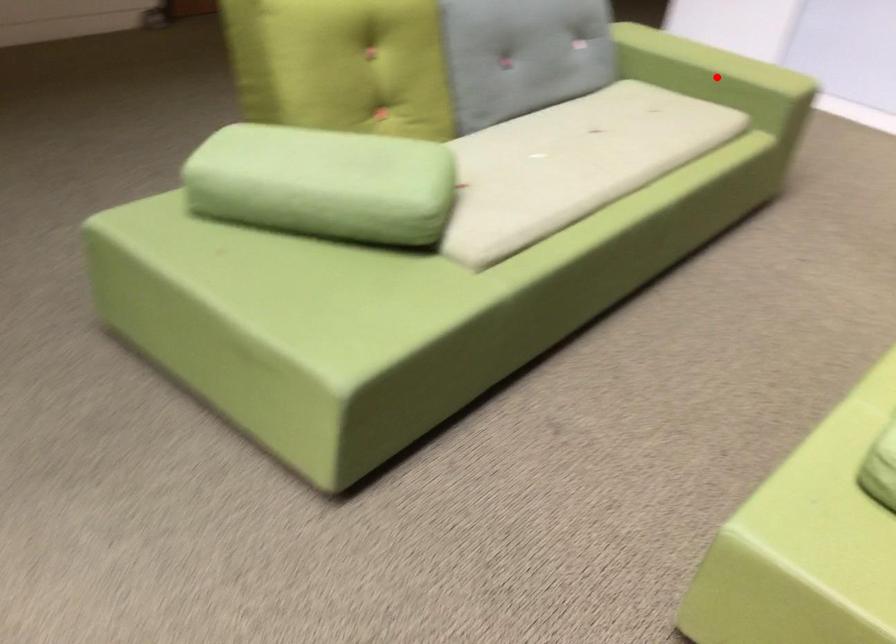
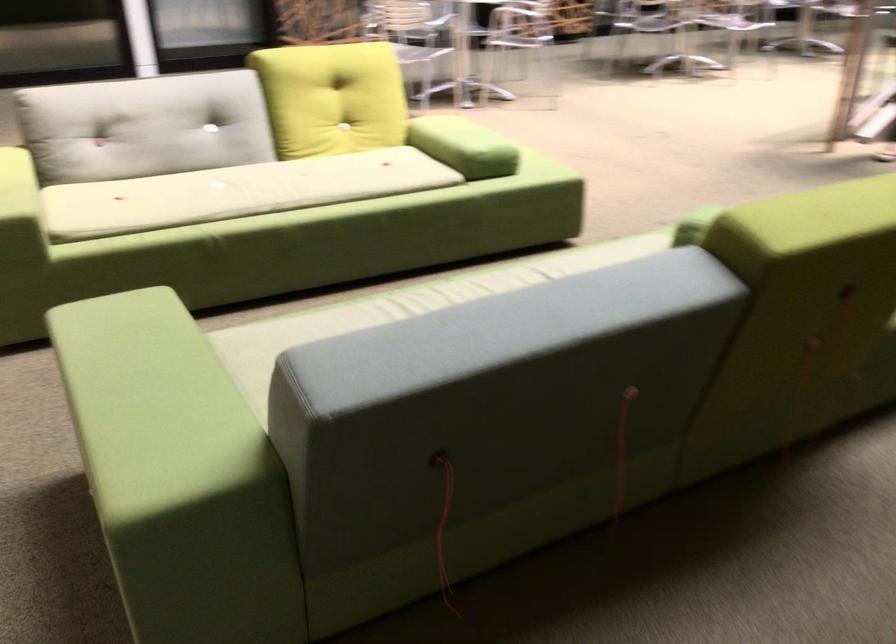
Question: I am providing you with two images of the same scene from different viewpoints. A red point is marked on the first image. Can you still see the location of the red point in image 2?

Choices:
 (A) Yes
 (B) No

Answer: (B)